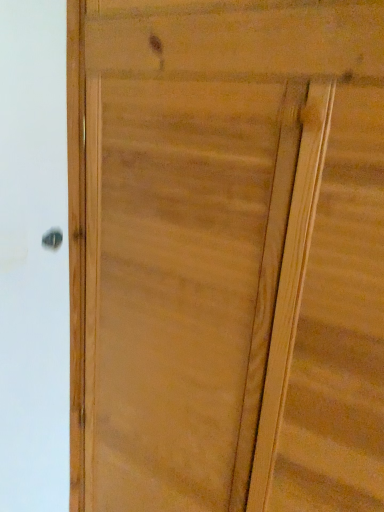
The image size is (384, 512). What do you see at coordinates (52, 238) in the screenshot?
I see `polished silver door handle at upper left` at bounding box center [52, 238].

What is the approximate height of polished silver door handle at upper left?

polished silver door handle at upper left is 1.90 inches tall.

Where is `polished silver door handle at upper left`? polished silver door handle at upper left is located at coordinates (52, 238).

Find the location of a particular element. The image size is (384, 512). polished silver door handle at upper left is located at coordinates (52, 238).